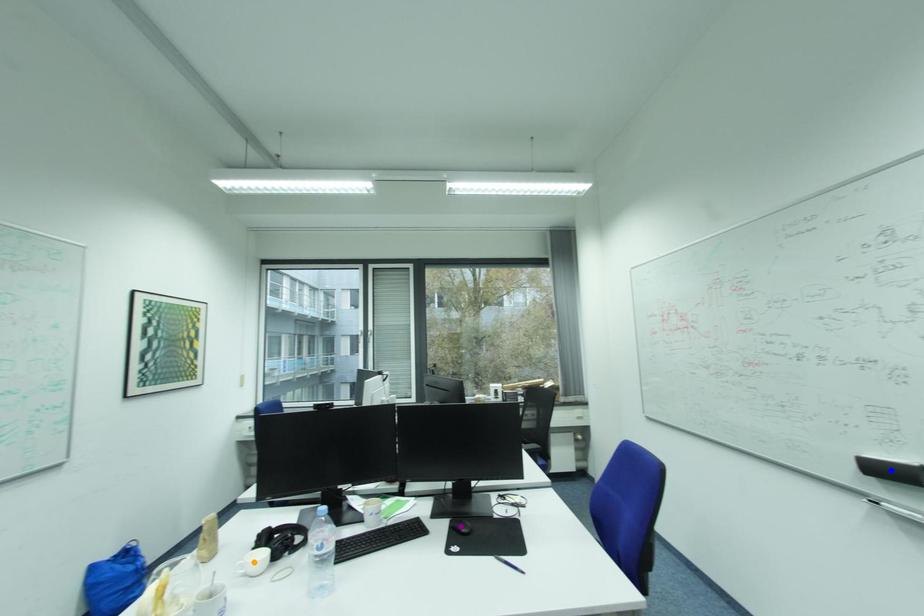
Order these from farthest to nearest:
A) orange point
B) purple point
C) blue point

1. purple point
2. orange point
3. blue point